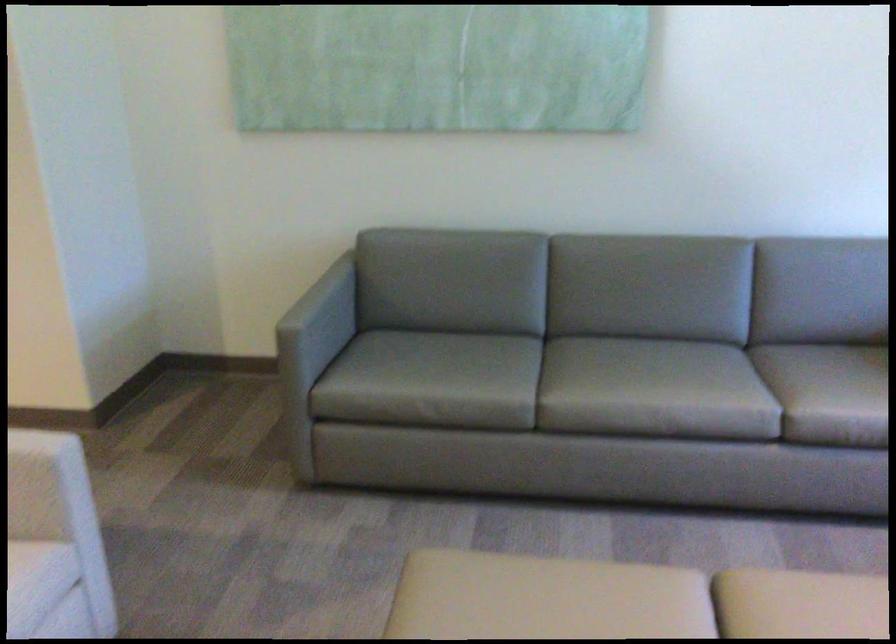
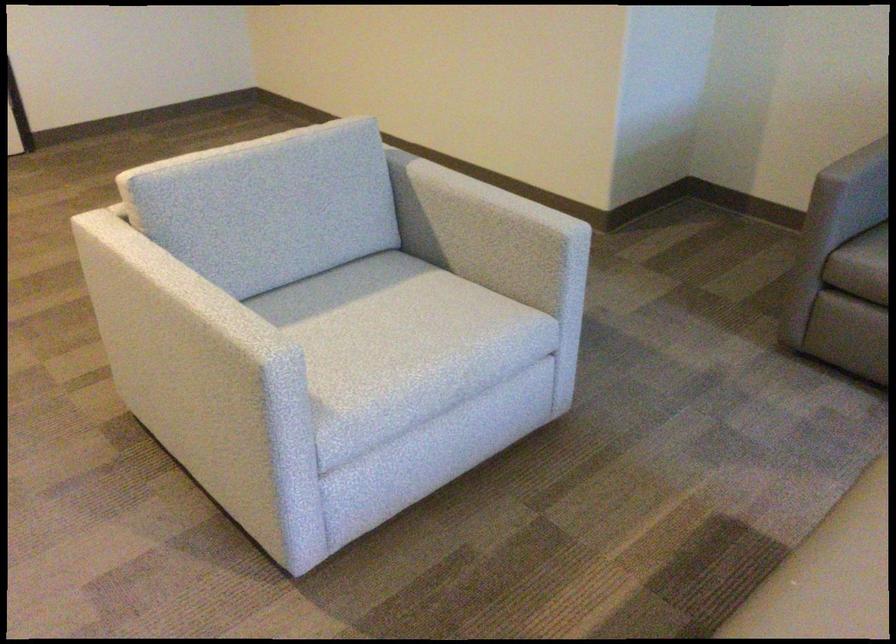
Locate, in the second image, the point that corresponds to point 305,313 in the first image.

(858, 164)